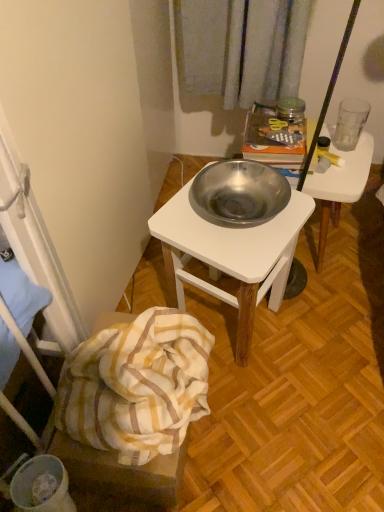
Locate an element on the screen. Image resolution: width=384 pixels, height=512 pixels. vacant space to the right of polished stainless steel bowl at center, positioned as the 1th desk in left-to-right order is located at coordinates (328, 333).